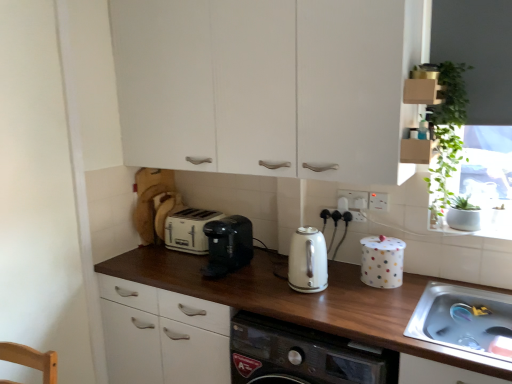
The image size is (512, 384). I want to click on vacant area that is situated to the right of black plastic coffee maker at center, the 2th kitchen appliance when ordered from right to left, so coord(266,272).